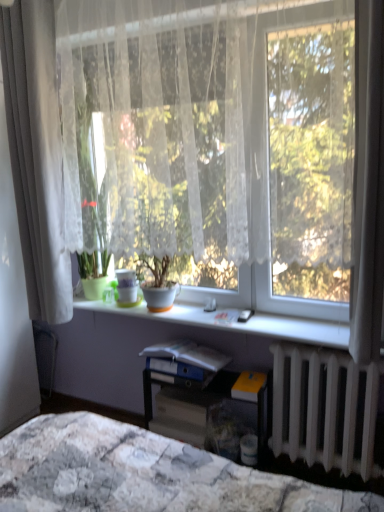
Measure the distance between matte plastic desk at center and camera.

matte plastic desk at center is 6.69 feet away from camera.

What is the approximate width of blue matte folder at center, the first paperback book positioned from the top?

The width of blue matte folder at center, the first paperback book positioned from the top, is 23.62 centimeters.

This screenshot has width=384, height=512. Describe the element at coordinates (94, 273) in the screenshot. I see `green matte pot at center, the 1th houseplant in the left-to-right sequence` at that location.

The image size is (384, 512). What are the coordinates of `matte white pot at center, which is counted as the 2th houseplant, starting from the left` in the screenshot? It's located at [x=158, y=284].

Is white lace curtain at center looking in the opposite direction of black plastic remote control at center?

That's right, white lace curtain at center is facing away from black plastic remote control at center.

From the image's perspective, between white lace curtain at center and black plastic remote control at center, which one is located above?

white lace curtain at center appears higher in the image.

Between white lace curtain at center and black plastic remote control at center, which one has larger size?

white lace curtain at center is bigger.

Which is behind, point (180, 99) or point (242, 312)?

The point (242, 312) is more distant.

Would you say black plastic remote control at center is outside green matte pot at center, the 1th houseplant in the left-to-right sequence?

black plastic remote control at center is positioned outside green matte pot at center, the 1th houseplant in the left-to-right sequence.

Is black plastic remote control at center bigger or smaller than green matte pot at center, the 1th houseplant in the left-to-right sequence?

In the image, black plastic remote control at center appears to be smaller than green matte pot at center, the 1th houseplant in the left-to-right sequence.

Is black plastic remote control at center next to green matte pot at center, the 1th houseplant in the left-to-right sequence?

No, black plastic remote control at center is not next to green matte pot at center, the 1th houseplant in the left-to-right sequence.

Based on the photo, from a real-world perspective, does black plastic remote control at center stand above green matte pot at center, the 1th houseplant in the left-to-right sequence?

Actually, black plastic remote control at center is physically below green matte pot at center, the 1th houseplant in the left-to-right sequence, in the real world.

Which is more to the right, matte white pot at center, which is counted as the 2th houseplant, starting from the left, or yellow matte paperback book at lower right, acting as the second paperback book starting from the top?

From the viewer's perspective, yellow matte paperback book at lower right, acting as the second paperback book starting from the top, appears more on the right side.

Is matte white pot at center, placed as the first houseplant when sorted from right to left, taller than yellow matte paperback book at lower right, acting as the second paperback book starting from the top?

Indeed, matte white pot at center, placed as the first houseplant when sorted from right to left, has a greater height compared to yellow matte paperback book at lower right, acting as the second paperback book starting from the top.

How many degrees apart are the facing directions of white sheer curtain at left and white glossy window sill at center?

They differ by 0.000591 degrees in their facing directions.

Is white sheer curtain at left inside or outside of white glossy window sill at center?

white sheer curtain at left is spatially situated outside white glossy window sill at center.

Could you tell me if white sheer curtain at left is facing white glossy window sill at center?

No, white sheer curtain at left is not aimed at white glossy window sill at center.

From the picture: Is matte white pot at center, placed as the first houseplant when sorted from right to left, to the left or to the right of matte gray paperback book at center, the first paperback book when ordered from bottom to top, in the image?

Clearly, matte white pot at center, placed as the first houseplant when sorted from right to left, is on the left of matte gray paperback book at center, the first paperback book when ordered from bottom to top, in the image.

From a real-world perspective, is matte white pot at center, which is counted as the 2th houseplant, starting from the left, located beneath matte gray paperback book at center, the 3th paperback book in the top-to-bottom sequence?

No, from a real-world perspective, matte white pot at center, which is counted as the 2th houseplant, starting from the left, is not under matte gray paperback book at center, the 3th paperback book in the top-to-bottom sequence.

From the picture: From the image's perspective, relative to matte gray paperback book at center, the 3th paperback book in the top-to-bottom sequence, is matte white pot at center, which is counted as the 2th houseplant, starting from the left, above or below?

Clearly, from the image's perspective, matte white pot at center, which is counted as the 2th houseplant, starting from the left, is above matte gray paperback book at center, the 3th paperback book in the top-to-bottom sequence.

Consider the image. Is the depth of matte white pot at center, which is counted as the 2th houseplant, starting from the left, less than that of matte gray paperback book at center, the first paperback book when ordered from bottom to top?

Yes, it is in front of matte gray paperback book at center, the first paperback book when ordered from bottom to top.

Is matte plastic desk at center inside the boundaries of green matte pot at center, placed as the second houseplant when sorted from right to left, or outside?

matte plastic desk at center is not inside green matte pot at center, placed as the second houseplant when sorted from right to left, it's outside.

Is matte plastic desk at center oriented towards green matte pot at center, placed as the second houseplant when sorted from right to left?

No, matte plastic desk at center does not turn towards green matte pot at center, placed as the second houseplant when sorted from right to left.

In the scene shown: Is the surface of matte plastic desk at center in direct contact with green matte pot at center, placed as the second houseplant when sorted from right to left?

No, matte plastic desk at center is not making contact with green matte pot at center, placed as the second houseplant when sorted from right to left.

From a real-world perspective, is matte plastic desk at center positioned over green matte pot at center, the 1th houseplant in the left-to-right sequence, based on gravity?

No, from a real-world perspective, matte plastic desk at center is not on top of green matte pot at center, the 1th houseplant in the left-to-right sequence.

Can you tell me how much matte gray paperback book at center, the 3th paperback book in the top-to-bottom sequence, and green matte pot at center, the 1th houseplant in the left-to-right sequence, differ in facing direction?

1.59 degrees separate the facing orientations of matte gray paperback book at center, the 3th paperback book in the top-to-bottom sequence, and green matte pot at center, the 1th houseplant in the left-to-right sequence.

From a real-world perspective, is matte gray paperback book at center, the 3th paperback book in the top-to-bottom sequence, physically below green matte pot at center, placed as the second houseplant when sorted from right to left?

Yes, from a real-world perspective, matte gray paperback book at center, the 3th paperback book in the top-to-bottom sequence, is under green matte pot at center, placed as the second houseplant when sorted from right to left.

How much distance is there between matte gray paperback book at center, the first paperback book when ordered from bottom to top, and green matte pot at center, the 1th houseplant in the left-to-right sequence?

The distance of matte gray paperback book at center, the first paperback book when ordered from bottom to top, from green matte pot at center, the 1th houseplant in the left-to-right sequence, is 30.66 inches.

I want to click on remote control located behind the white lace curtain at center, so click(245, 315).

Where is `remote control below the green matte pot at center, placed as the second houseplant when sorted from right to left (from the image's perspective)`? remote control below the green matte pot at center, placed as the second houseplant when sorted from right to left (from the image's perspective) is located at coordinates (245, 315).

In the scene shown: Considering their positions, is blue matte folder at center, the first paperback book positioned from the top, positioned closer to matte plastic desk at center than yellow matte paperback book at lower right, acting as the second paperback book starting from the top?

yellow matte paperback book at lower right, acting as the second paperback book starting from the top, lies closer to matte plastic desk at center than the other object.

Which object lies nearer to the anchor point green matte pot at center, placed as the second houseplant when sorted from right to left, matte plastic desk at center or matte white pot at center, placed as the first houseplant when sorted from right to left?

matte white pot at center, placed as the first houseplant when sorted from right to left.

Considering their positions, is white lace curtain at center positioned closer to yellow matte paperback book at lower right, marked as the 2th paperback book in a bottom-to-top arrangement, than matte plastic desk at center?

Among the two, matte plastic desk at center is located nearer to yellow matte paperback book at lower right, marked as the 2th paperback book in a bottom-to-top arrangement.

Looking at the image, which one is located further to yellow matte paperback book at lower right, acting as the second paperback book starting from the top, black plastic remote control at center or white glossy window sill at center?

white glossy window sill at center lies further to yellow matte paperback book at lower right, acting as the second paperback book starting from the top, than the other object.

Estimate the real-world distances between objects in this image. Which object is closer to green matte pot at center, placed as the second houseplant when sorted from right to left, matte gray paperback book at center, the 3th paperback book in the top-to-bottom sequence, or blue matte folder at center, the first paperback book positioned from the top?

blue matte folder at center, the first paperback book positioned from the top.

Looking at the image, which one is located further to yellow matte paperback book at lower right, marked as the 2th paperback book in a bottom-to-top arrangement, white lace curtain at center or blue matte folder at center, which appears as the 3th paperback book when ordered from the bottom?

Among the two, white lace curtain at center is located further to yellow matte paperback book at lower right, marked as the 2th paperback book in a bottom-to-top arrangement.

Looking at the image, which one is located further to blue matte folder at center, which appears as the 3th paperback book when ordered from the bottom, white sheer curtain at left or yellow matte paperback book at lower right, marked as the 2th paperback book in a bottom-to-top arrangement?

Based on the image, white sheer curtain at left appears to be further to blue matte folder at center, which appears as the 3th paperback book when ordered from the bottom.

Based on their spatial positions, is black plastic remote control at center or matte gray paperback book at center, the first paperback book when ordered from bottom to top, further from matte white pot at center, which is counted as the 2th houseplant, starting from the left?

matte gray paperback book at center, the first paperback book when ordered from bottom to top, is positioned further to the anchor matte white pot at center, which is counted as the 2th houseplant, starting from the left.

Find the location of a particular element. Image resolution: width=384 pixels, height=512 pixels. window sill between black plastic remote control at center and matte plastic desk at center vertically is located at coordinates (249, 319).

Image resolution: width=384 pixels, height=512 pixels. Identify the location of desk situated between blue matte folder at center, the first paperback book positioned from the top, and white metallic radiator at lower right from left to right. (210, 410).

Image resolution: width=384 pixels, height=512 pixels. What are the coordinates of `remote control between white lace curtain at center and blue matte folder at center, which appears as the 3th paperback book when ordered from the bottom, from top to bottom` in the screenshot? It's located at (245, 315).

I want to click on desk between white glossy window sill at center and white metallic radiator at lower right, so coord(210,410).